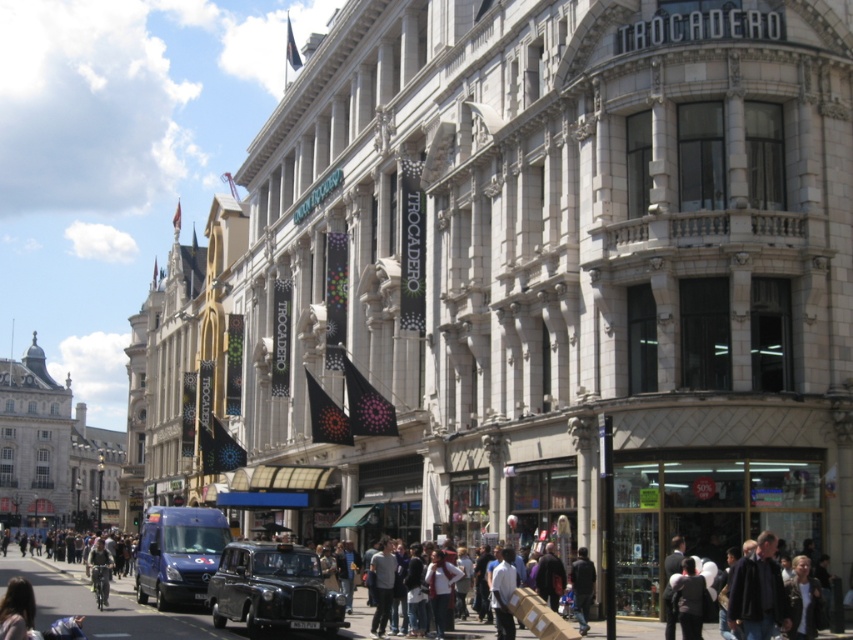
Question: In this image, where is blue metallic van at center-left located relative to dark gray clothing at lower left?

Choices:
 (A) below
 (B) above

Answer: (B)

Question: Which point is farther from the camera taking this photo?

Choices:
 (A) (697, 588)
 (B) (280, 550)
 (C) (738, 608)
 (D) (570, 576)

Answer: (D)

Question: Which of the following is the farthest from the observer?

Choices:
 (A) dark blue jacket at lower left
 (B) dark blue jacket at lower center

Answer: (A)

Question: Which object is positioned closest to the dark blue jacket at lower center?

Choices:
 (A) dark gray suit at center
 (B) blue metallic van at center-left
 (C) dark gray clothing at lower left
 (D) black matte taxi at center

Answer: (A)

Question: Does black matte taxi at center appear on the left side of dark gray suit at center?

Choices:
 (A) yes
 (B) no

Answer: (A)

Question: Does dark gray clothing at lower left have a greater width compared to dark blue jacket at lower left?

Choices:
 (A) yes
 (B) no

Answer: (A)